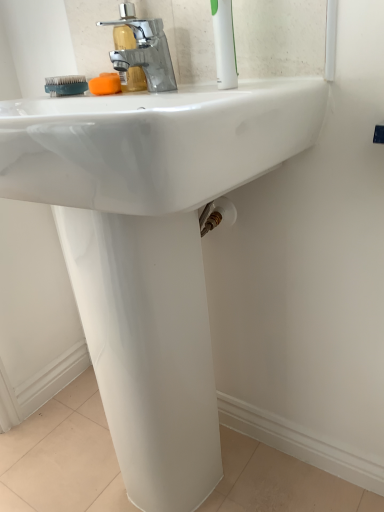
Identify the location of vacant area that lies in front of orange sponge at upper center. This screenshot has height=512, width=384. point(116,100).